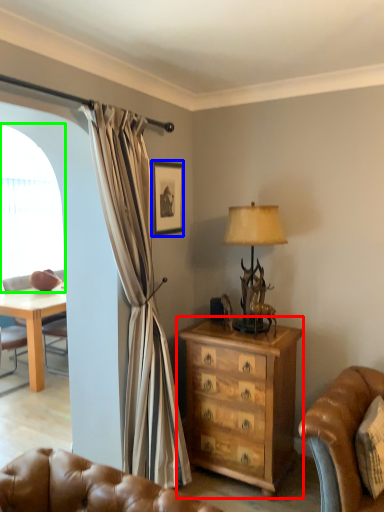
Question: Considering the real-world distances, which object is farthest from chest of drawers (highlighted by a red box)? picture frame (highlighted by a blue box) or window screen (highlighted by a green box)?

Choices:
 (A) picture frame
 (B) window screen

Answer: (B)